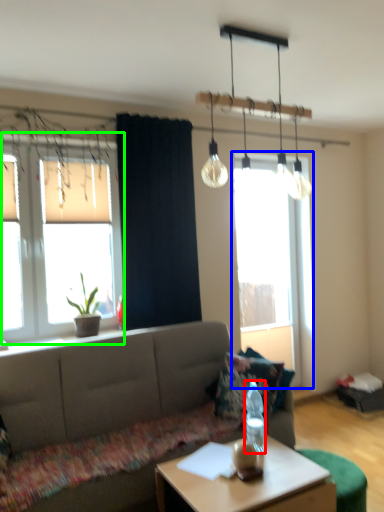
Question: Estimate the real-world distances between objects in this image. Which object is closer to bottle (highlighted by a red box), window (highlighted by a blue box) or window (highlighted by a green box)?

Choices:
 (A) window
 (B) window

Answer: (B)